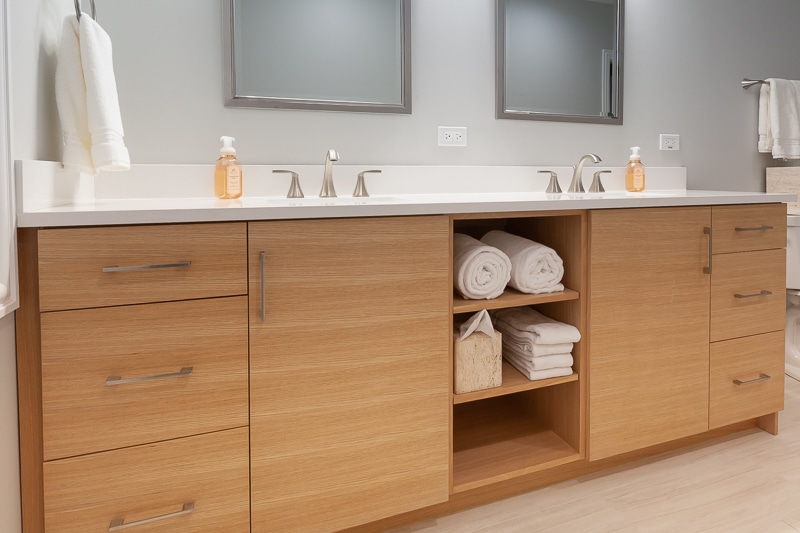
Where is `stored towels`? This screenshot has height=533, width=800. stored towels is located at coordinates (486, 260), (538, 255).